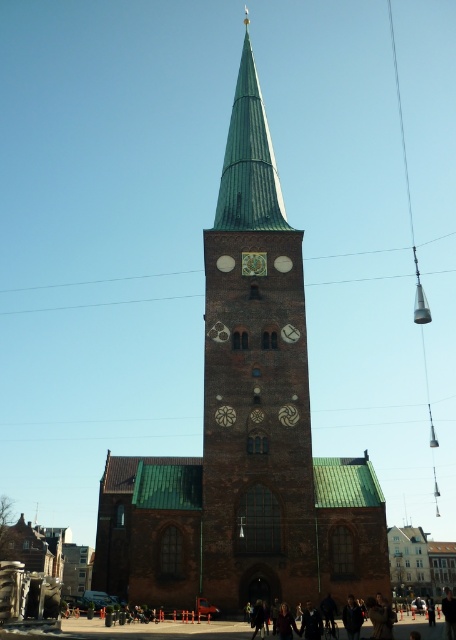
You are standing in front of the church tower and want to take a photo of the green stone church tower at center and the green copper spire at center. Which object will appear larger in your photo?

The green stone church tower at center will appear larger in the photo because it is closer to the viewer than the green copper spire at center.

You are standing in front of the church and want to take a photo that includes both the green stone church tower at center and the green copper spire at center. Which object should you position to the left side of your camera frame to ensure both are visible?

You should position the green copper spire at center to the left side of your camera frame because the green stone church tower at center is to the right of the green copper spire at center, so placing the spire on the left will allow the tower to naturally align to its right within the frame.